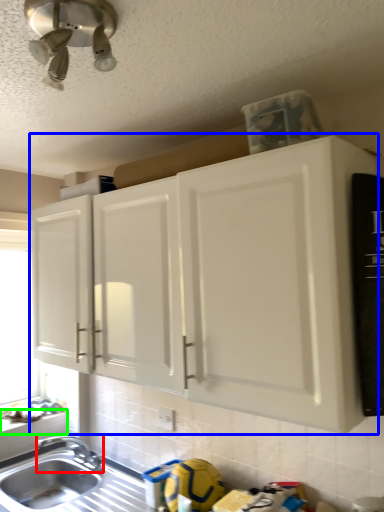
Question: Which object is positioned closest to tap (highlighted by a red box)? Select from cabinetry (highlighted by a blue box) and window sill (highlighted by a green box).

Choices:
 (A) cabinetry
 (B) window sill

Answer: (B)